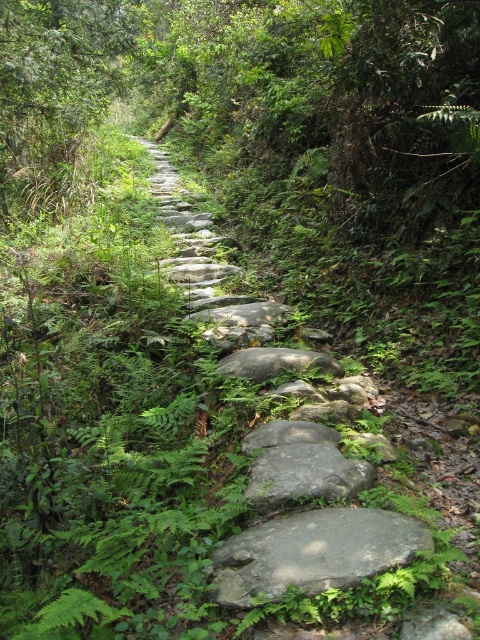
Which is behind, point (383, 525) or point (251, 436)?

Point (251, 436)

Can you confirm if gray/rough stone at center is smaller than gray smooth stone at center?

Incorrect, gray/rough stone at center is not smaller in size than gray smooth stone at center.

I want to click on gray/rough stone at center, so click(313, 552).

Where is `gray/rough stone at center`? gray/rough stone at center is located at coordinates (313, 552).

Is gray rough stone at center closer to the viewer compared to gray smooth rock at center?

Yes, it is.

Between gray rough stone at center and gray smooth rock at center, which one appears on the left side from the viewer's perspective?

gray smooth rock at center

Who is more distant from viewer, (282,449) or (227,368)?

Point (227,368)

Find the location of a particular element. gray rough stone at center is located at coordinates (304, 474).

Who is higher up, gray/rough stone at center or gray rough stone at center?

Positioned higher is gray rough stone at center.

Does gray/rough stone at center have a lesser height compared to gray rough stone at center?

In fact, gray/rough stone at center may be taller than gray rough stone at center.

Find the location of a particular element. This screenshot has width=480, height=640. gray/rough stone at center is located at coordinates (313, 552).